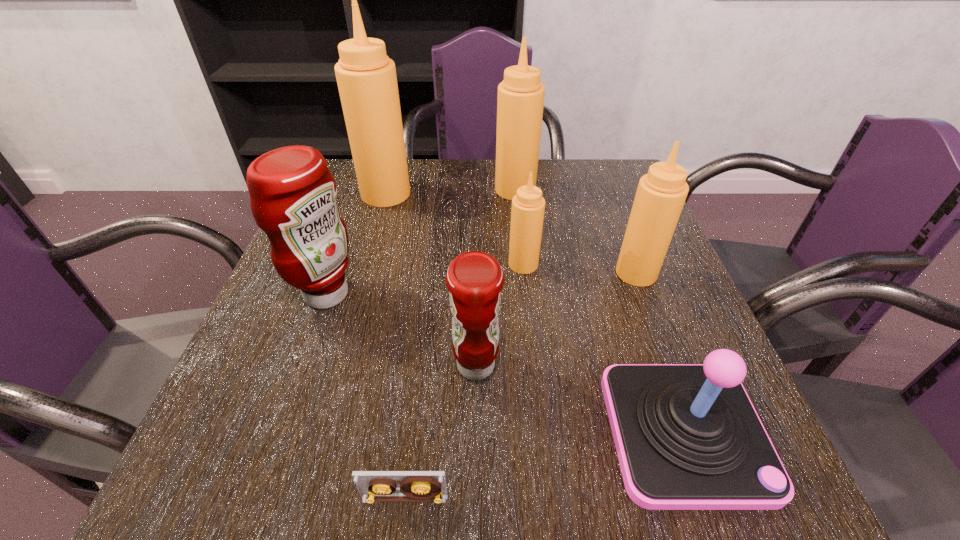
Where is `condiment that is the closest to the videotape`? The height and width of the screenshot is (540, 960). condiment that is the closest to the videotape is located at coordinates (474, 279).

Identify which condiment is the fourth nearest to the rightmost condiment. Please provide its 2D coordinates. Your answer should be formatted as a tuple, i.e. [(x, y)], where the tuple contains the x and y coordinates of a point satisfying the conditions above.

[(366, 77)]

This screenshot has width=960, height=540. Identify the location of the third closest tan condiment relative to the tallest object. (661, 194).

Locate which tan condiment is the closest to the third condiment from left to right. Please provide its 2D coordinates. Your answer should be formatted as a tuple, i.e. [(x, y)], where the tuple contains the x and y coordinates of a point satisfying the conditions above.

[(527, 214)]